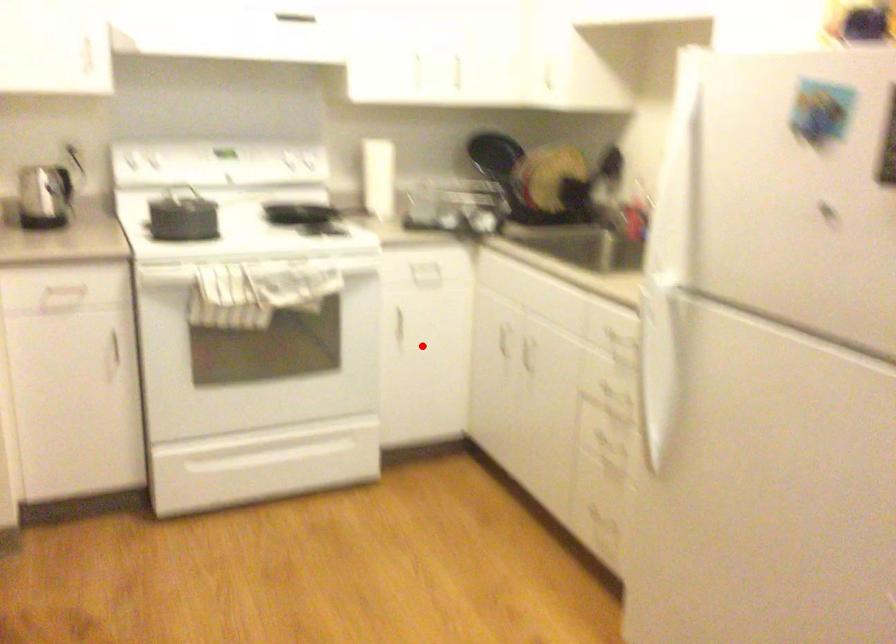
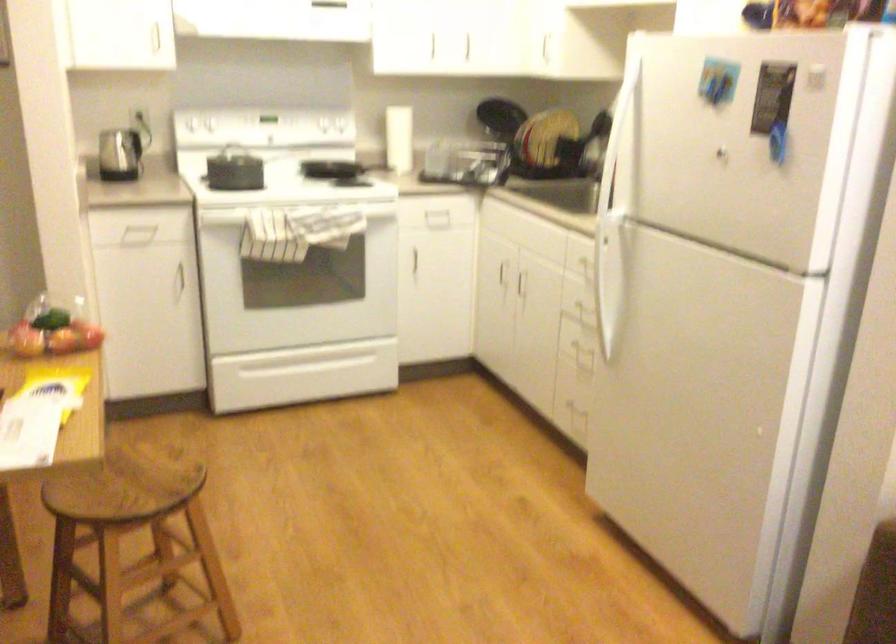
Locate, in the second image, the point that corresponds to the highlighted location in the first image.

(435, 276)